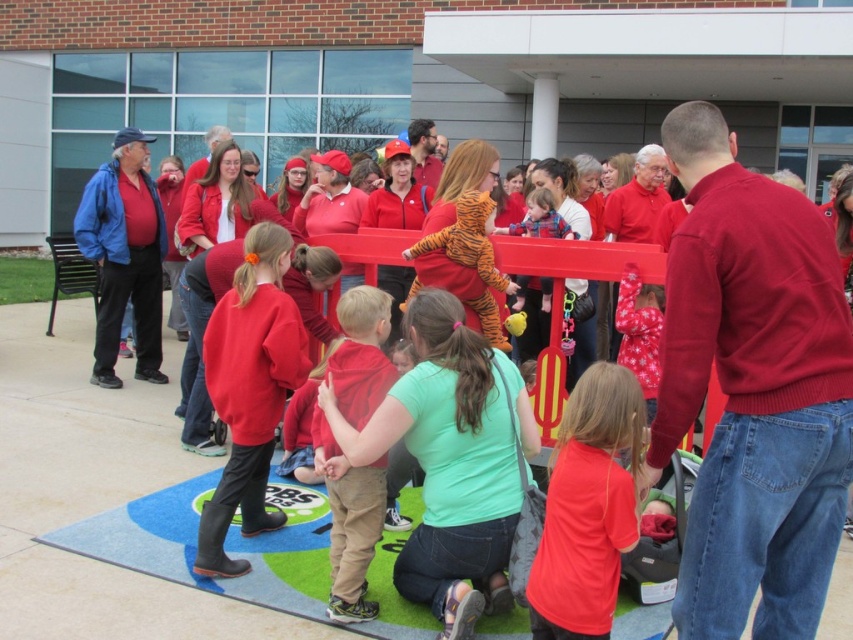
You are a photographer trying to capture a clear photo of both the matte red shirt at center and the matte red sweatshirt at center. Since you want both subjects to be in focus, you need to adjust your camera settings. Which object is closer to you, making it potentially easier to focus on first?

The matte red shirt at center is closer to the viewer than the matte red sweatshirt at center, so it would be easier to focus on first.

From the picture: You are standing at the center of the image. You want to walk to the blue artificial turf mat at lower center. Which direction should you go?

The blue artificial turf mat at lower center is located at point (225, 541), which is to the lower center direction from your current position at the center. Therefore, you should move downward to reach it.